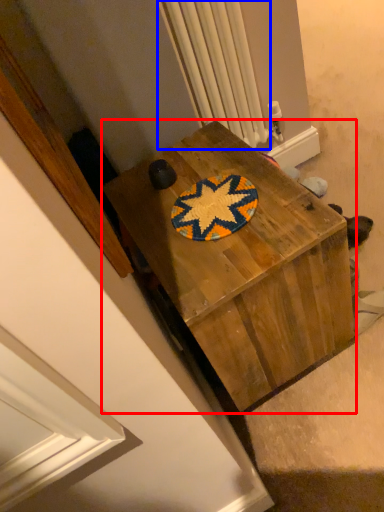
Question: Which point is further to the camera, desk (highlighted by a red box) or radiator (highlighted by a blue box)?

Choices:
 (A) desk
 (B) radiator

Answer: (B)